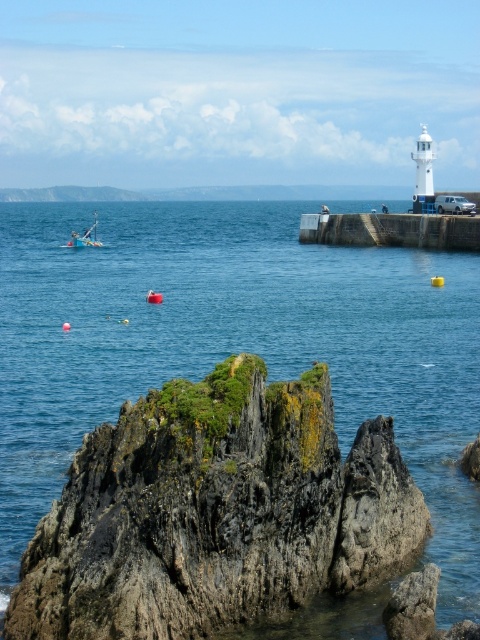
You are standing on the pier on the right side of the frame. You see a point marked at coordinates [232,342]. Based on the scene description, where is this point located?

The point at coordinates [232,342] is located on the blue water at center.

You are a photographer standing on the pier at the right side of the image. You want to capture a photo of the blue water at center and the concrete at right in your shot. Which object will appear larger in your photo?

The blue water at center will appear larger in the photo because it is much taller than the concrete at right.

You are a photographer planning to capture the entire scene in one shot. Given that the concrete at right and the yellow plastic boat at left are both in the frame, which object should you focus on to ensure both are clearly visible without cropping?

You should focus on the yellow plastic boat at left because it occupies more space in the frame than the concrete at right, making it the larger subject to prioritize for clarity.